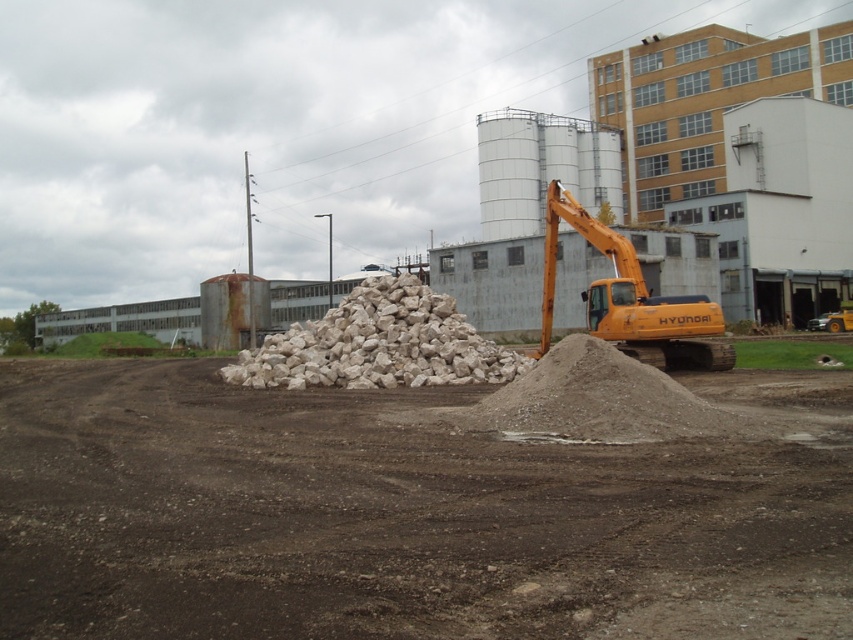
You are a construction worker standing at the base of the excavator in the image. You need to place two markers at the coordinates point (x=361, y=348) and point (x=595, y=308). Which marker will be placed closer to your current position?

The point (x=361, y=348) is closer to the viewer than point (x=595, y=308), so the marker at point (x=361, y=348) will be closer to your current position.